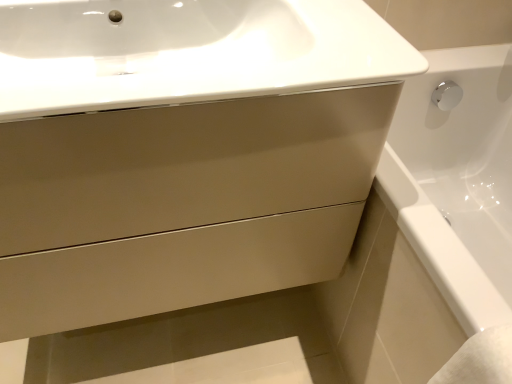
Question: From the image's perspective, does white glossy sink at upper center appear higher than matte beige drawer at center?

Choices:
 (A) no
 (B) yes

Answer: (B)

Question: Does white glossy sink at upper center have a smaller size compared to matte beige drawer at center?

Choices:
 (A) yes
 (B) no

Answer: (A)

Question: From a real-world perspective, is white glossy sink at upper center under matte beige drawer at center?

Choices:
 (A) yes
 (B) no

Answer: (B)

Question: Considering the relative sizes of white glossy sink at upper center and matte beige drawer at center in the image provided, is white glossy sink at upper center thinner than matte beige drawer at center?

Choices:
 (A) yes
 (B) no

Answer: (B)

Question: Is white glossy sink at upper center oriented towards matte beige drawer at center?

Choices:
 (A) no
 (B) yes

Answer: (B)

Question: Is matte beige drawer at center inside white glossy sink at upper center?

Choices:
 (A) yes
 (B) no

Answer: (B)

Question: Is matte beige drawer at center not inside white glossy sink at upper center?

Choices:
 (A) yes
 (B) no

Answer: (A)

Question: Can you confirm if matte beige drawer at center is positioned to the left of white glossy sink at upper center?

Choices:
 (A) no
 (B) yes

Answer: (B)

Question: Can white glossy sink at upper center be found inside matte beige drawer at center?

Choices:
 (A) no
 (B) yes

Answer: (B)

Question: Is matte beige drawer at center oriented towards white glossy sink at upper center?

Choices:
 (A) no
 (B) yes

Answer: (A)

Question: Is matte beige drawer at center in front of white glossy sink at upper center?

Choices:
 (A) yes
 (B) no

Answer: (B)

Question: From a real-world perspective, is matte beige drawer at center beneath white glossy sink at upper center?

Choices:
 (A) no
 (B) yes

Answer: (B)

Question: Considering the positions of matte beige drawer at center and white glossy sink at upper center in the image, is matte beige drawer at center wider or thinner than white glossy sink at upper center?

Choices:
 (A) thin
 (B) wide

Answer: (A)